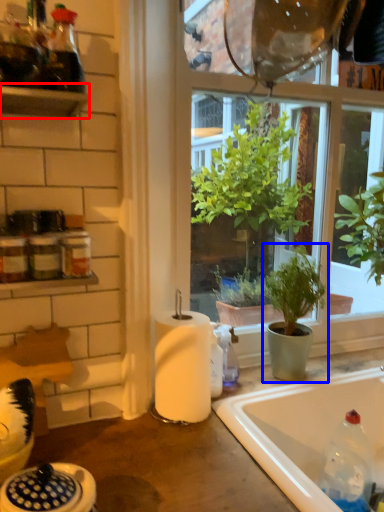
Question: Which of the following is the farthest to the observer, shelf (highlighted by a red box) or houseplant (highlighted by a blue box)?

Choices:
 (A) shelf
 (B) houseplant

Answer: (B)